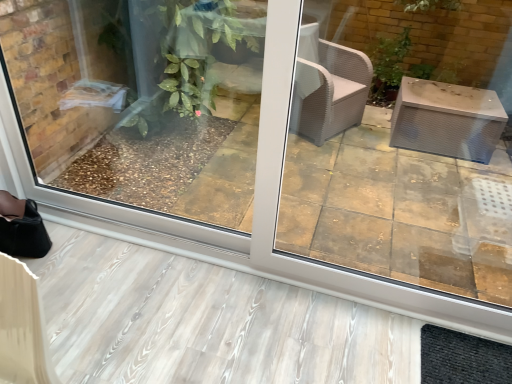
Locate an element on the screen. The height and width of the screenshot is (384, 512). transparent glass window screen at lower left is located at coordinates (141, 100).

This screenshot has height=384, width=512. Describe the element at coordinates (141, 100) in the screenshot. I see `transparent glass window screen at lower left` at that location.

Identify the location of transparent glass window screen at lower left. This screenshot has height=384, width=512. (141, 100).